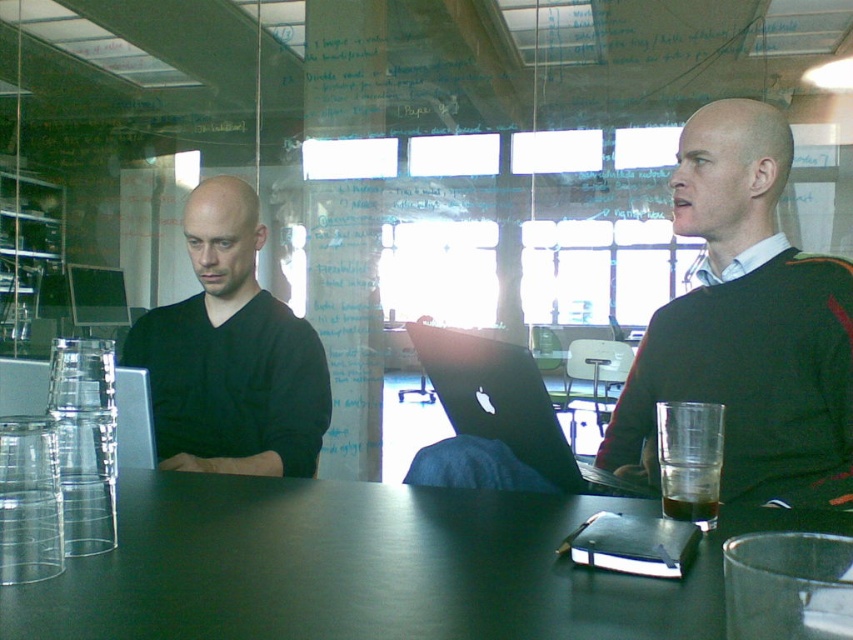
Question: Which is farther from the black matte sweater at center?

Choices:
 (A) matte black laptop at left
 (B) black matte table at center
 (C) black matte laptop at center

Answer: (A)

Question: Which point is farther to the camera?

Choices:
 (A) (810, 323)
 (B) (152, 564)
 (C) (467, 424)
 (D) (292, 317)

Answer: (D)

Question: Is black matte sweater at center closer to camera compared to black matte laptop at center?

Choices:
 (A) yes
 (B) no

Answer: (B)

Question: Does black matte table at center appear on the left side of matte black laptop at left?

Choices:
 (A) yes
 (B) no

Answer: (B)

Question: Considering the relative positions of black matte table at center and matte black laptop at left in the image provided, where is black matte table at center located with respect to matte black laptop at left?

Choices:
 (A) left
 (B) right

Answer: (B)

Question: Which object is positioned closest to the black matte table at center?

Choices:
 (A) black matte laptop at center
 (B) matte black laptop at left

Answer: (A)